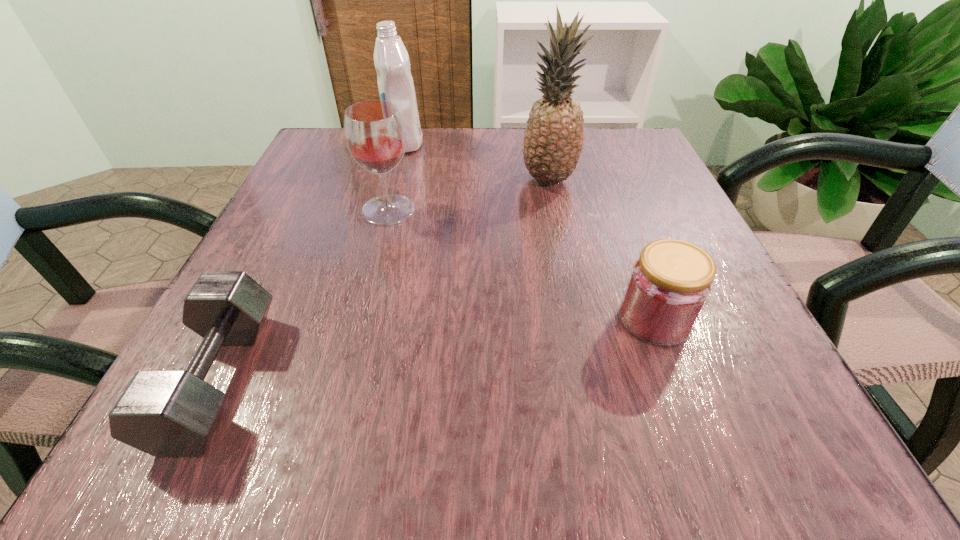
At what (x,y) coordinates should I click in order to perform the action: click on the tallest object. Please return your answer as a coordinate pair (x, y). Image resolution: width=960 pixels, height=540 pixels. Looking at the image, I should click on (553, 142).

This screenshot has width=960, height=540. I want to click on the fourth object from left to right, so click(553, 142).

Where is `detergent`? The height and width of the screenshot is (540, 960). detergent is located at coordinates (395, 83).

Where is `the second tallest object`? The height and width of the screenshot is (540, 960). the second tallest object is located at coordinates click(x=395, y=83).

Where is `the third farthest object`? the third farthest object is located at coordinates (374, 131).

Locate an element on the screen. The image size is (960, 540). wineglass is located at coordinates (374, 131).

Image resolution: width=960 pixels, height=540 pixels. In order to click on the rightmost object in this screenshot , I will do `click(670, 283)`.

In order to click on the second shortest object in this screenshot , I will do `click(670, 283)`.

Where is `the shortest object`? This screenshot has height=540, width=960. the shortest object is located at coordinates (163, 413).

What are the coordinates of `dumbbell` in the screenshot? It's located at (163, 413).